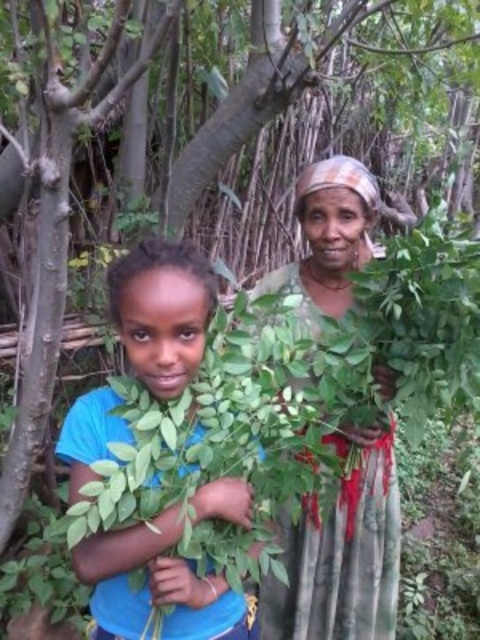
Question: Where is blue fabric shirt at center located in relation to green fabric dress at center in the image?

Choices:
 (A) right
 (B) left

Answer: (B)

Question: Which point is farther to the camera?

Choices:
 (A) (312, 602)
 (B) (179, 532)

Answer: (A)

Question: Which point is farther to the camera?

Choices:
 (A) (356, 570)
 (B) (158, 586)

Answer: (A)

Question: Which point is closer to the camera?

Choices:
 (A) green fabric dress at center
 (B) blue fabric shirt at center

Answer: (B)

Question: Does blue fabric shirt at center appear on the left side of green fabric dress at center?

Choices:
 (A) no
 (B) yes

Answer: (B)

Question: Is blue fabric shirt at center bigger than green fabric dress at center?

Choices:
 (A) yes
 (B) no

Answer: (B)